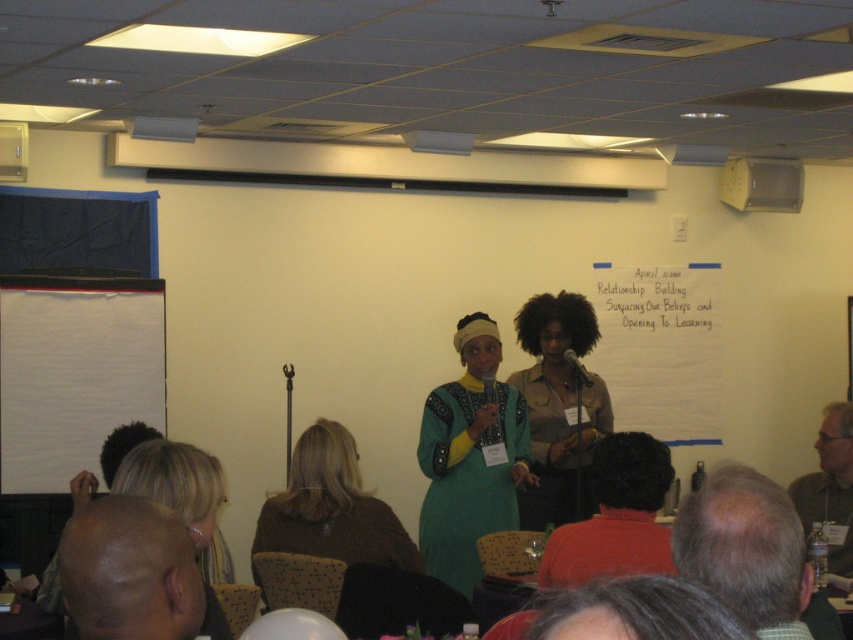
You are standing in the conference room and see the point marked at coordinates (x=329, y=508). According to the scene description, where exactly is this point located?

The point is located on the brown fuzzy sweater at lower center.

You are standing in the conference room and need to hand out a document to the person wearing the matte khaki shirt at center. The document is on the white paperboard at center. Can you reach the document without moving closer than 5 feet?

The distance between the matte khaki shirt at center and the white paperboard at center is 5.19 feet. Since 5.19 feet is slightly more than 5 feet, you would need to move closer to reach the document.